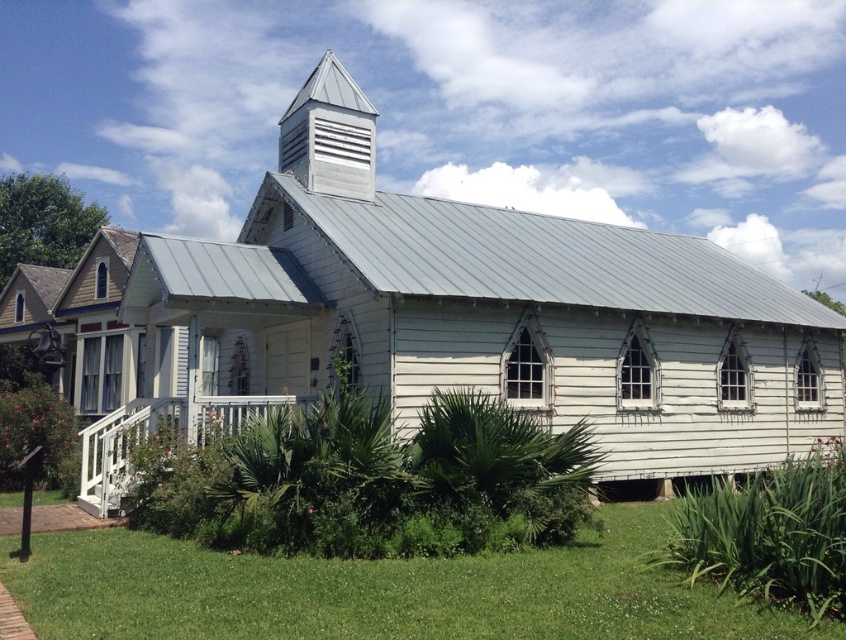
Question: Which point appears farthest from the camera in this image?

Choices:
 (A) (312, 72)
 (B) (141, 412)
 (C) (259, 387)
 (D) (169, 561)

Answer: (A)

Question: Is white wood church at center below white painted wood porch at lower left?

Choices:
 (A) no
 (B) yes

Answer: (A)

Question: Does green grass at lower center appear on the left side of metallic silver spire at upper center?

Choices:
 (A) yes
 (B) no

Answer: (B)

Question: Which point is closer to the camera taking this photo?

Choices:
 (A) (86, 481)
 (B) (110, 296)
 (C) (278, 122)
 (D) (515, 612)

Answer: (D)

Question: Estimate the real-world distances between objects in this image. Which object is closer to the metallic silver spire at upper center?

Choices:
 (A) green grass at lower center
 (B) white wood church at center

Answer: (B)

Question: Is green grass at lower center wider than white painted wood porch at lower left?

Choices:
 (A) yes
 (B) no

Answer: (B)